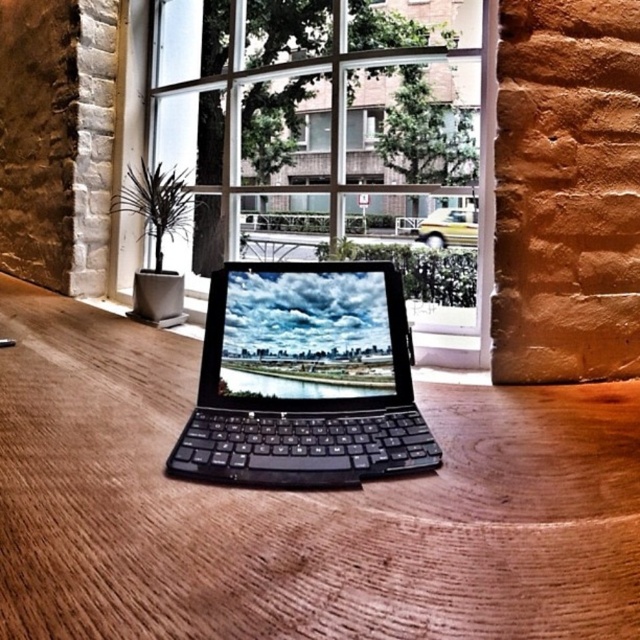
Question: Does black matte keyboard at center come behind yellow matte car at center?

Choices:
 (A) yes
 (B) no

Answer: (B)

Question: Which object is positioned farthest from the transparent glass window at center?

Choices:
 (A) yellow matte car at center
 (B) black matte keyboard at center

Answer: (B)

Question: Which of these objects is positioned farthest from the wooden table at center?

Choices:
 (A) transparent glass window at center
 (B) black matte keyboard at center

Answer: (A)

Question: Is transparent glass window at center behind yellow matte car at center?

Choices:
 (A) no
 (B) yes

Answer: (A)

Question: Does wooden table at center have a greater width compared to transparent glass window at center?

Choices:
 (A) no
 (B) yes

Answer: (B)

Question: Among these points, which one is farthest from the camera?

Choices:
 (A) (323, 348)
 (B) (541, 552)
 (C) (435, 220)

Answer: (C)